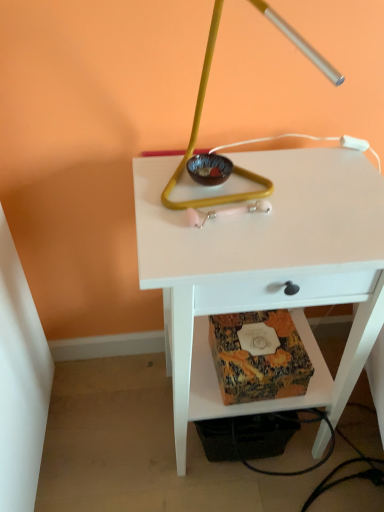
Question: Is patterned paper at lower center facing away from white matte table at center?

Choices:
 (A) yes
 (B) no

Answer: (A)

Question: Is patterned paper at lower center taller than white matte table at center?

Choices:
 (A) yes
 (B) no

Answer: (B)

Question: Is patterned paper at lower center facing towards white matte table at center?

Choices:
 (A) yes
 (B) no

Answer: (A)

Question: Is patterned paper at lower center completely or partially outside of white matte table at center?

Choices:
 (A) no
 (B) yes

Answer: (A)

Question: Does patterned paper at lower center have a greater width compared to white matte table at center?

Choices:
 (A) yes
 (B) no

Answer: (B)

Question: Is matte brown glass bowl at center taller or shorter than metallic gold lamp at center?

Choices:
 (A) tall
 (B) short

Answer: (B)

Question: Do you think matte brown glass bowl at center is within metallic gold lamp at center, or outside of it?

Choices:
 (A) outside
 (B) inside

Answer: (B)

Question: From the image's perspective, is matte brown glass bowl at center located above or below metallic gold lamp at center?

Choices:
 (A) below
 (B) above

Answer: (A)

Question: Considering the relative positions of matte brown glass bowl at center and metallic gold lamp at center in the image provided, is matte brown glass bowl at center to the left or to the right of metallic gold lamp at center?

Choices:
 (A) left
 (B) right

Answer: (A)

Question: In terms of width, does metallic gold lamp at center look wider or thinner when compared to matte brown glass bowl at center?

Choices:
 (A) thin
 (B) wide

Answer: (B)

Question: From their relative heights in the image, would you say metallic gold lamp at center is taller or shorter than matte brown glass bowl at center?

Choices:
 (A) short
 (B) tall

Answer: (B)

Question: Do you think metallic gold lamp at center is within matte brown glass bowl at center, or outside of it?

Choices:
 (A) outside
 (B) inside

Answer: (A)

Question: In the image, is metallic gold lamp at center on the left side or the right side of matte brown glass bowl at center?

Choices:
 (A) left
 (B) right

Answer: (B)

Question: Do you think white matte table at center is within matte brown glass bowl at center, or outside of it?

Choices:
 (A) inside
 (B) outside

Answer: (B)

Question: Is point (299, 196) closer or farther from the camera than point (216, 178)?

Choices:
 (A) closer
 (B) farther

Answer: (A)